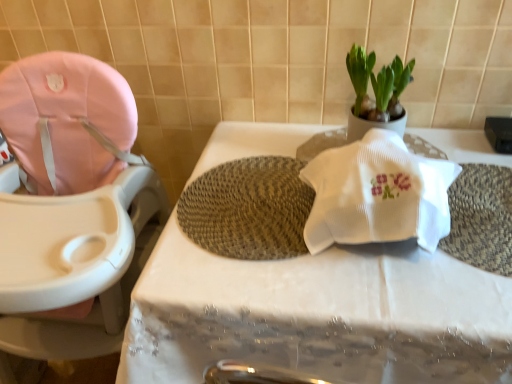
You are a GUI agent. You are given a task and a screenshot of the screen. Output one action in this format:
    pyautogui.click(x=<x>, y=<y>)
    Task: Click on the vacant space in front of woven beige bath mat at center
    Image resolution: width=512 pixels, height=384 pixels.
    Given the screenshot: What is the action you would take?
    pyautogui.click(x=295, y=289)